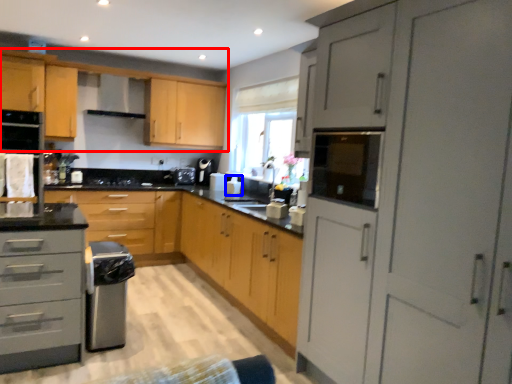
Question: Which point is closer to the camera, cabinetry (highlighted by a red box) or appliance (highlighted by a blue box)?

Choices:
 (A) cabinetry
 (B) appliance

Answer: (A)